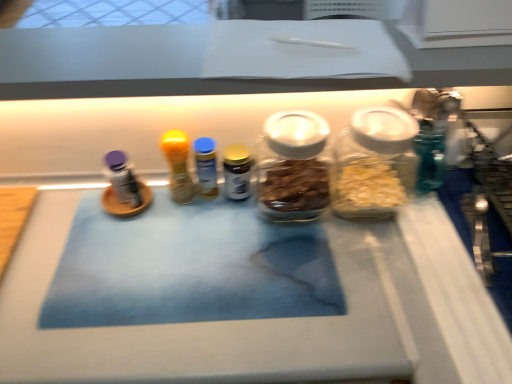
The width and height of the screenshot is (512, 384). I want to click on vacant space to the right of yellow matte bottle at center, marked as the 1th bottle in a left-to-right arrangement, so click(273, 232).